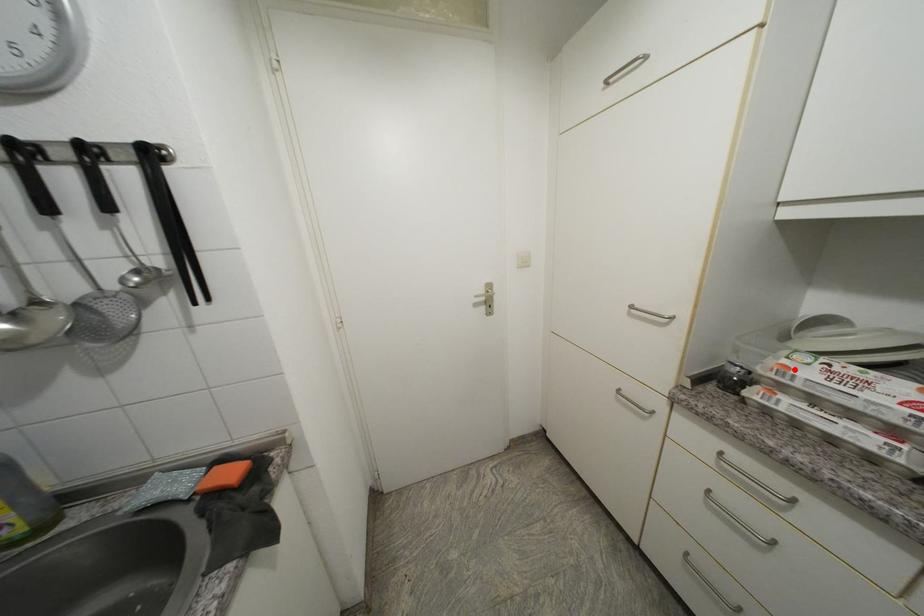
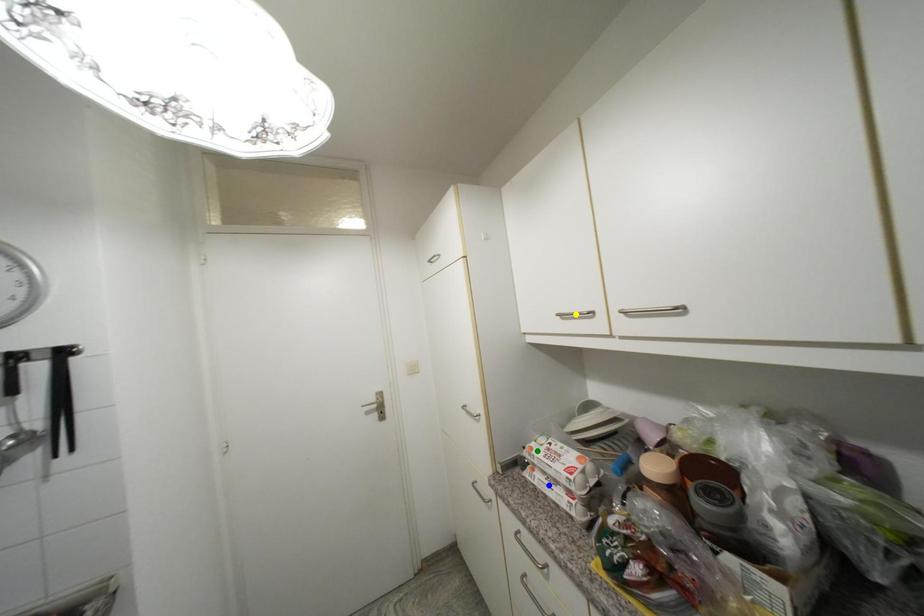
Question: I am providing you with two images of the same scene from different viewpoints. A red point is marked on the first image. You are given multiple points on the second image. Which spot in image 2 lines up with the point in image 1?

Choices:
 (A) green point
 (B) yellow point
 (C) blue point

Answer: (A)